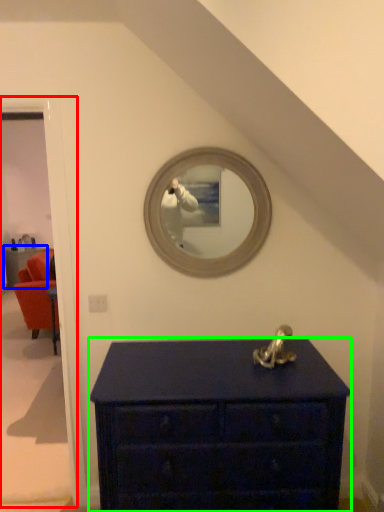
Question: Considering the real-world distances, which object is farthest from door (highlighted by a red box)? furniture (highlighted by a blue box) or chest of drawers (highlighted by a green box)?

Choices:
 (A) furniture
 (B) chest of drawers

Answer: (A)